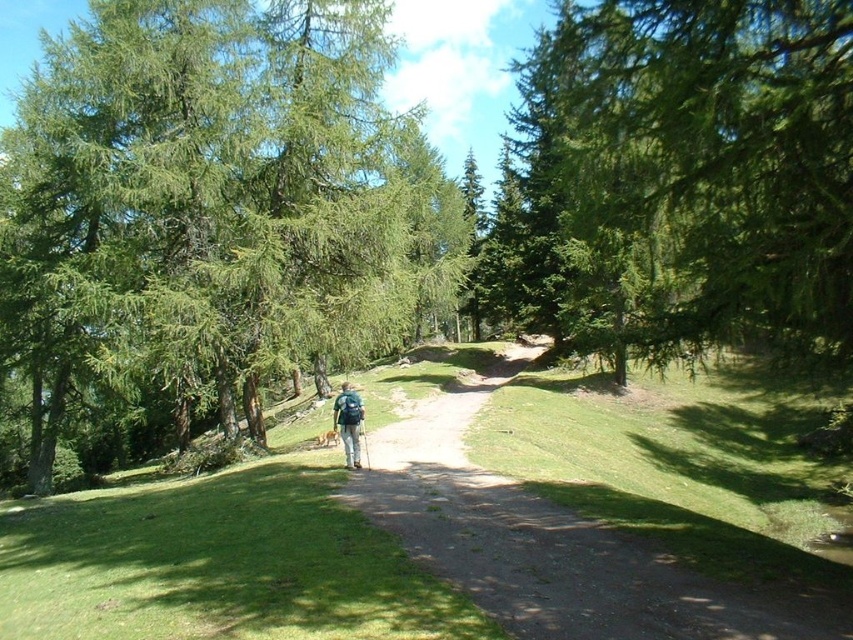
Can you confirm if green needle-like tree at center is wider than green fabric backpack at center?

Indeed, green needle-like tree at center has a greater width compared to green fabric backpack at center.

How far apart are green needle-like tree at center and green fabric backpack at center?

green needle-like tree at center and green fabric backpack at center are 38.54 feet apart from each other.

Between point (381, 342) and point (341, 394), which one is positioned in front?

Point (341, 394) is in front.

The image size is (853, 640). I want to click on green needle-like tree at center, so click(x=212, y=211).

At what (x,y) coordinates should I click in order to perform the action: click on green textured tree at upper center. Please return your answer as a coordinate pair (x, y). Looking at the image, I should click on (682, 182).

Is point (779, 262) less distant than point (450, 426)?

Yes.

The width and height of the screenshot is (853, 640). I want to click on green textured tree at upper center, so click(x=682, y=182).

Does green needle-like tree at center have a lesser height compared to dirt path at center?

In fact, green needle-like tree at center may be taller than dirt path at center.

Is green needle-like tree at center above dirt path at center?

Correct, green needle-like tree at center is located above dirt path at center.

At what (x,y) coordinates should I click in order to perform the action: click on green needle-like tree at center. Please return your answer as a coordinate pair (x, y). Looking at the image, I should click on (212, 211).